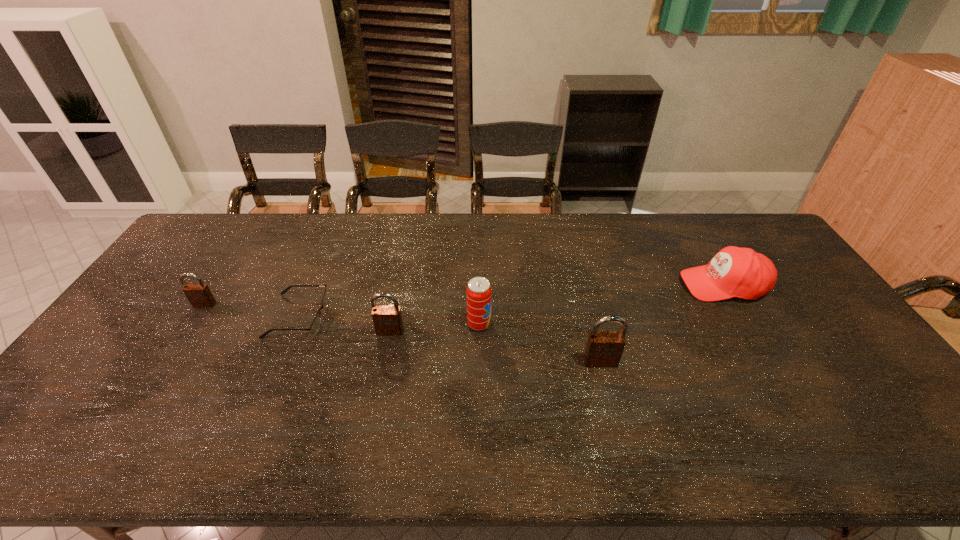
This screenshot has height=540, width=960. What are the coordinates of `blank space located on the front-facing side of the farthest padlock` in the screenshot? It's located at (173, 353).

Locate an element on the screen. The width and height of the screenshot is (960, 540). vacant space located on the front-facing side of the fourth object from right to left is located at coordinates (374, 408).

Identify the location of free region located 0.050m on the front-facing side of the rightmost padlock. (606, 384).

Where is `vacant space situated 0.260m on the front panel of the baseball cap`? vacant space situated 0.260m on the front panel of the baseball cap is located at coordinates (599, 285).

Where is `free spot located on the front panel of the baseball cap`? The height and width of the screenshot is (540, 960). free spot located on the front panel of the baseball cap is located at coordinates (580, 285).

You are a GUI agent. You are given a task and a screenshot of the screen. Output one action in this format:
    pyautogui.click(x=<x>, y=<y>)
    Task: Click on the free region located on the front panel of the baseball cap
    This screenshot has height=540, width=960.
    Given the screenshot: What is the action you would take?
    pyautogui.click(x=558, y=285)

Where is `free space located 0.050m on the right of the soda can`? This screenshot has width=960, height=540. free space located 0.050m on the right of the soda can is located at coordinates (508, 324).

I want to click on vacant space located on the front-facing side of the fifth object from right to left, so click(397, 316).

Find the location of a particular element. The width and height of the screenshot is (960, 540). object that is at the right edge is located at coordinates (738, 272).

At what (x,y) coordinates should I click in order to perform the action: click on free space at the far edge. Please return your answer as a coordinate pair (x, y). This screenshot has width=960, height=540. Looking at the image, I should click on (396, 248).